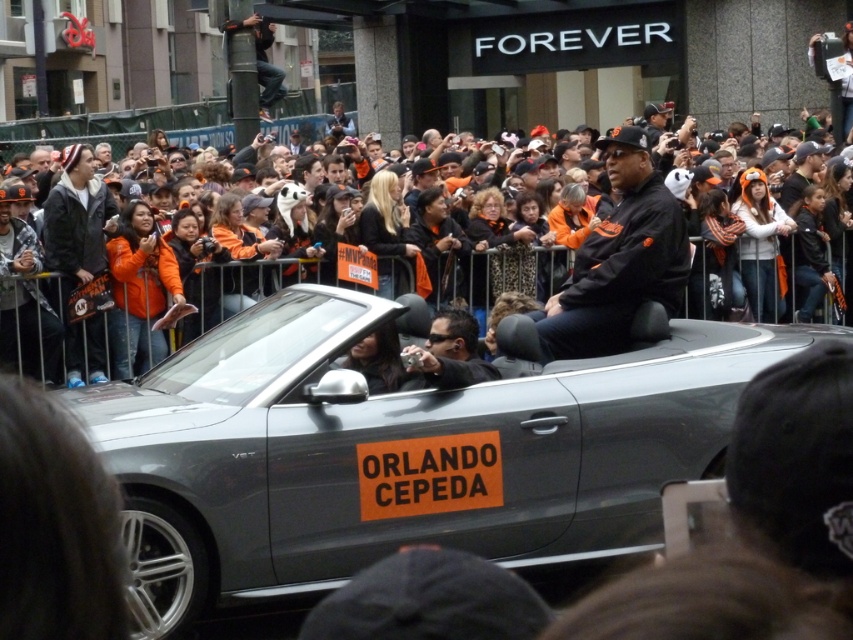
You are a photographer positioned at the origin point of the image. You need to capture a photo of the black matte jacket at center. What are the coordinates of the object you need to focus on?

The coordinates of the black matte jacket at center are at point (618, 259).